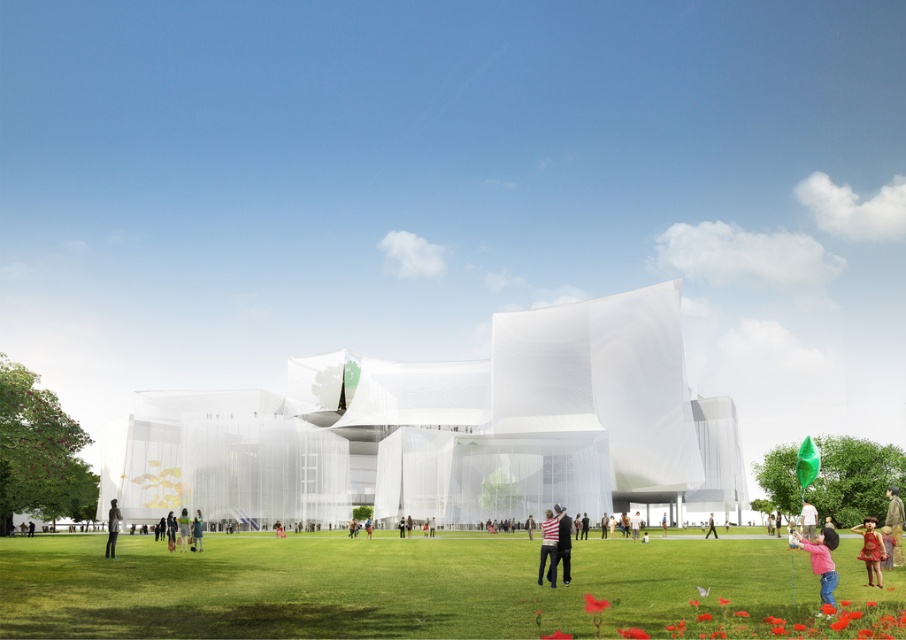
Based on the photo, does green fabric person at lower left have a greater width compared to pink fabric at lower right?

Correct, the width of green fabric person at lower left exceeds that of pink fabric at lower right.

Which is behind, point (113, 509) or point (811, 515)?

The point (113, 509) is behind.

I want to click on green fabric person at lower left, so click(x=112, y=529).

Based on the photo, which is more to the right, red dress at lower right or striped fabric at center?

red dress at lower right

Is red dress at lower right shorter than striped fabric at center?

Yes.

This screenshot has width=906, height=640. What do you see at coordinates (894, 522) in the screenshot? I see `red dress at lower right` at bounding box center [894, 522].

At what (x,y) coordinates should I click in order to perform the action: click on red dress at lower right. Please return your answer as a coordinate pair (x, y). Looking at the image, I should click on (894, 522).

Who is more distant from viewer, (548, 577) or (111, 540)?

The point (111, 540) is behind.

Measure the distance between point (566,577) and camera.

178.82 feet

The image size is (906, 640). In order to click on striped fabric at center in this screenshot , I will do `click(564, 541)`.